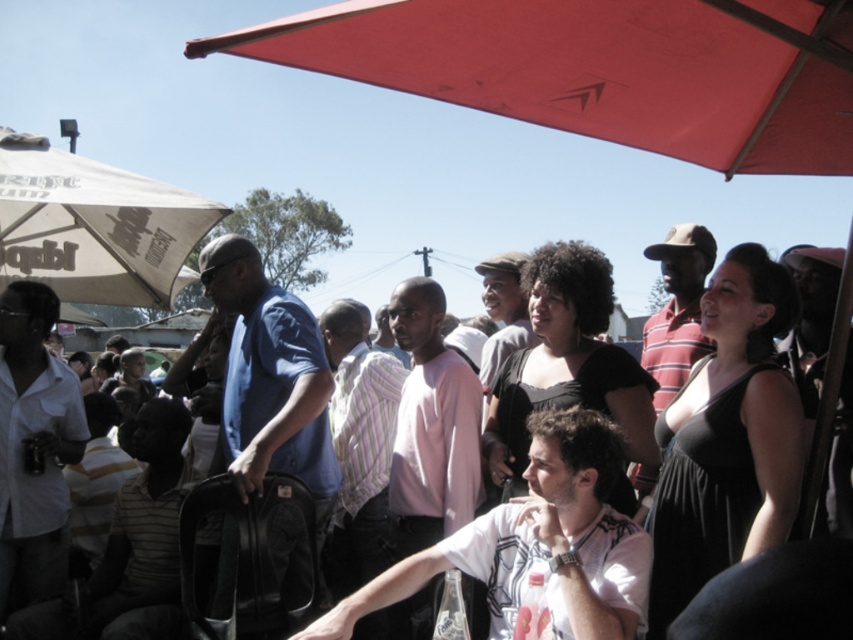
Question: Does red matte canopy at upper center appear under white cotton t-shirt at center?

Choices:
 (A) no
 (B) yes

Answer: (A)

Question: Estimate the real-world distances between objects in this image. Which object is closer to the white cotton t-shirt at center?

Choices:
 (A) matte black dress at center
 (B) white fabric umbrella at upper left
 (C) striped cotton shirt at center
 (D) red matte canopy at upper center

Answer: (A)

Question: Does red fabric umbrella at upper center come behind striped cotton shirt at center?

Choices:
 (A) no
 (B) yes

Answer: (A)

Question: Which object is closer to the camera taking this photo?

Choices:
 (A) matte black dress at center
 (B) pink cotton shirt at center
 (C) striped cotton shirt at center

Answer: (A)

Question: Which point is farther from the camera taking this photo?

Choices:
 (A) pyautogui.click(x=560, y=506)
 (B) pyautogui.click(x=277, y=355)
 (C) pyautogui.click(x=679, y=256)

Answer: (C)

Question: Is red matte canopy at upper center smaller than blue matte shirt at center?

Choices:
 (A) yes
 (B) no

Answer: (A)